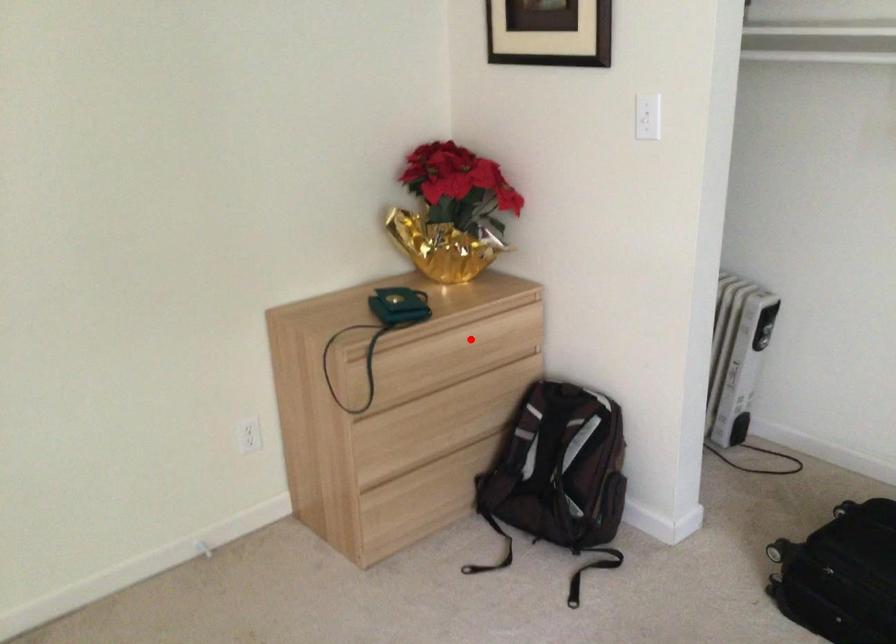
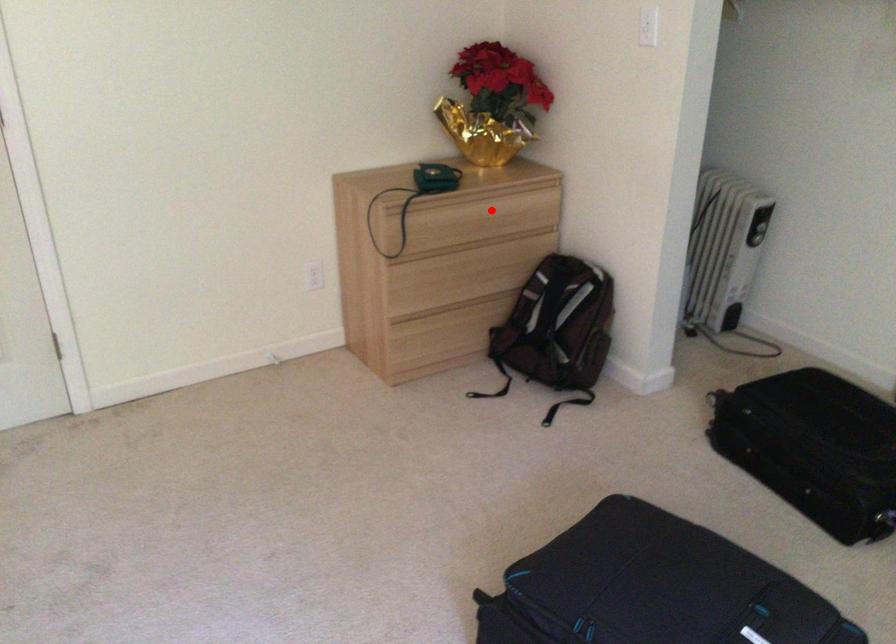
I am providing you with two images of the same scene from different viewpoints. A red point is marked on the first image and another point is marked on the second image. Are the points marked in image1 and image2 representing the same 3D position?

Yes